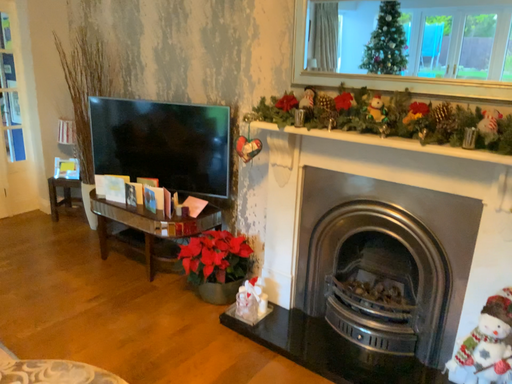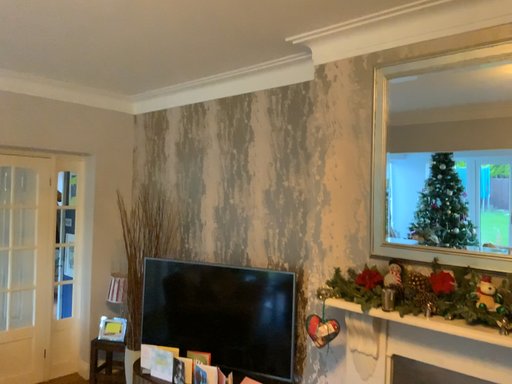
Question: How did the camera likely rotate when shooting the video?

Choices:
 (A) rotated upward
 (B) rotated downward

Answer: (A)